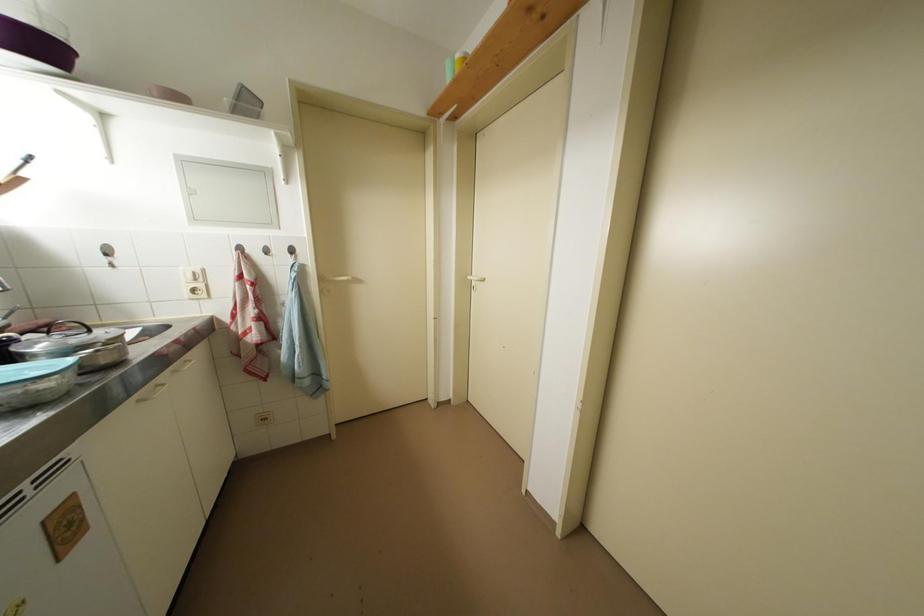
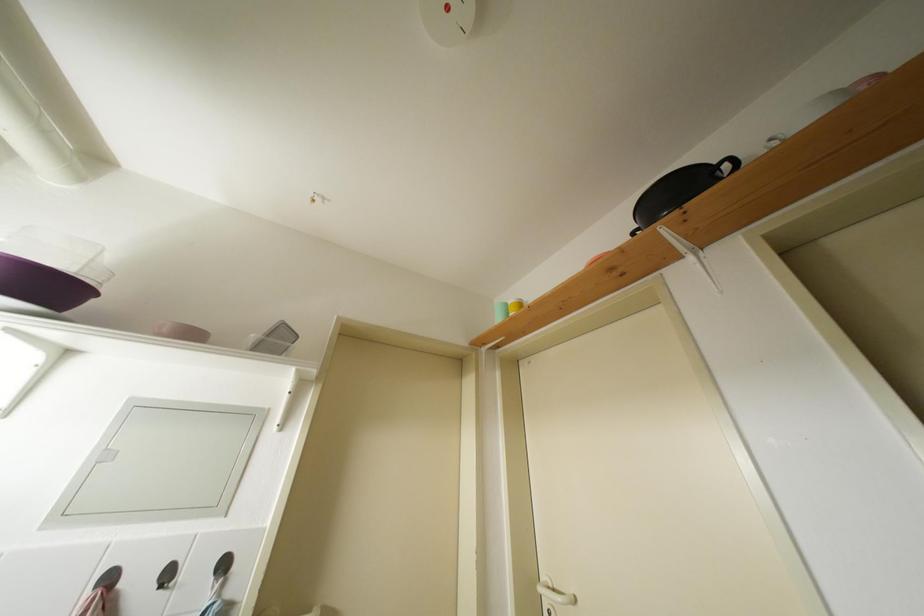
Question: Based on the continuous images, in which direction is the camera rotating? Reply with the corresponding letter.

Choices:
 (A) Left
 (B) Right
 (C) Up
 (D) Down

Answer: (C)